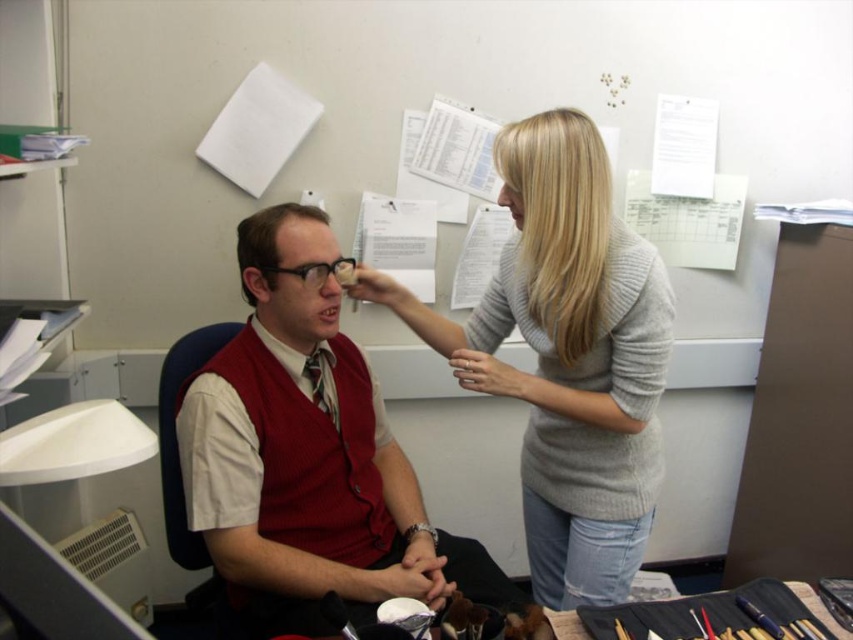
Question: Which point appears farthest from the camera in this image?

Choices:
 (A) (323, 253)
 (B) (627, 532)
 (C) (347, 356)

Answer: (C)

Question: Is matte red vest at center smaller than matte black forehead at center?

Choices:
 (A) no
 (B) yes

Answer: (A)

Question: Is the position of matte red vest at center less distant than that of light gray sweater at upper right?

Choices:
 (A) yes
 (B) no

Answer: (A)

Question: Among these objects, which one is farthest from the camera?

Choices:
 (A) light gray sweater at upper right
 (B) matte red vest at center

Answer: (A)

Question: Which object appears closest to the camera in this image?

Choices:
 (A) light gray sweater at upper right
 (B) matte red vest at center

Answer: (B)

Question: Can you confirm if matte red vest at center is positioned to the right of light gray sweater at upper right?

Choices:
 (A) no
 (B) yes

Answer: (A)